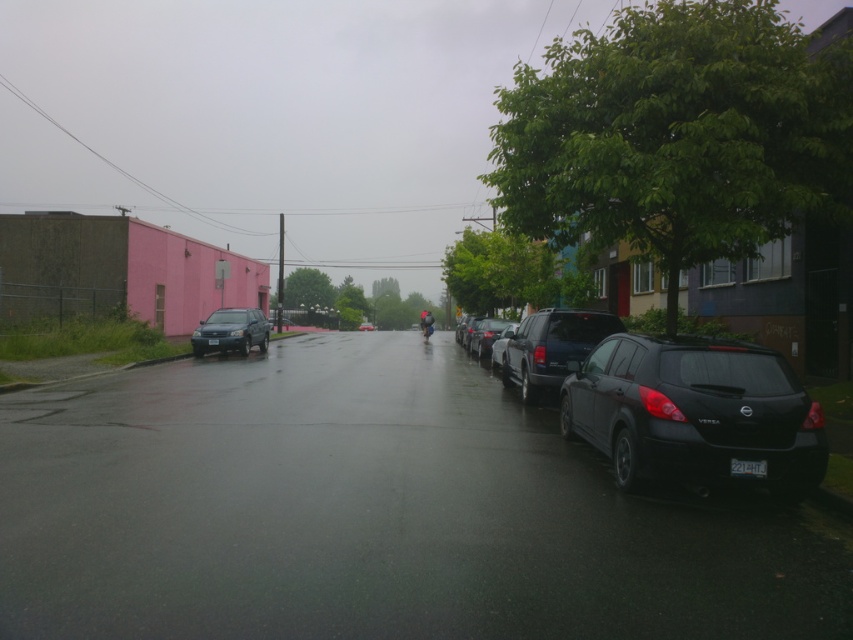
Consider the image. You are a delivery driver who needs to park your 12 meter long truck between the shiny dark blue suv at right and the satin black sedan at center. Is there enough space between them to park your truck?

The shiny dark blue suv at right is 11.51 meters from the satin black sedan at center. Since the truck is 12 meters long, there isn